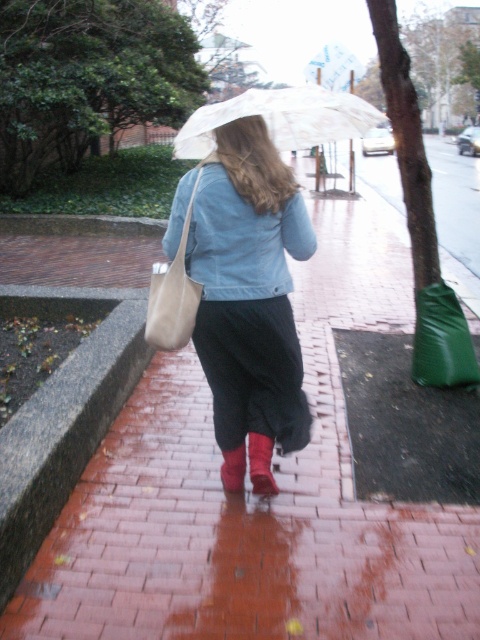
You are a delivery robot with a 1.5 meter wide package. You need to pass between the green matte shopping bag at lower right and the red suede boot at lower center. Can you fit through the space between them?

The green matte shopping bag at lower right and the red suede boot at lower center are 1.82 meters apart from each other. Since the package is 1.5 meters wide, there is enough space for the delivery robot to pass through the gap between them.

You are a photographer trying to capture the scene. You notice the green matte shopping bag at lower right and the rubber matte boot at lower center. Which object is positioned farther to the right side of the image?

The green matte shopping bag at lower right is positioned farther to the right side of the image than the rubber matte boot at lower center.